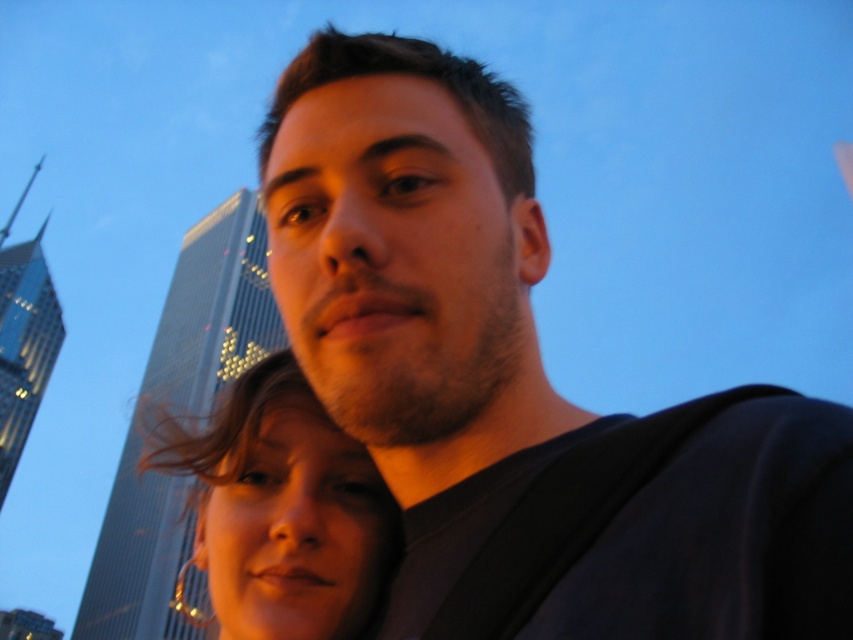
You are a fashion designer analyzing the image. You need to determine which item of clothing or accessory is larger in size between the matte black shirt at center and the matte gold hoop earrings at lower left. Based on the scene, which one is bigger?

The matte gold hoop earrings at lower left are larger in size than the matte black shirt at center according to the description.